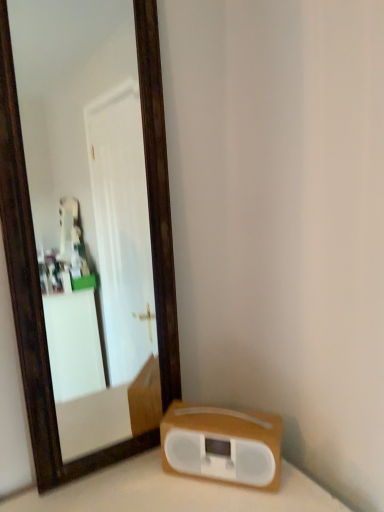
Image resolution: width=384 pixels, height=512 pixels. Identify the location of free location to the left of white plastic stereo at lower right. (139, 477).